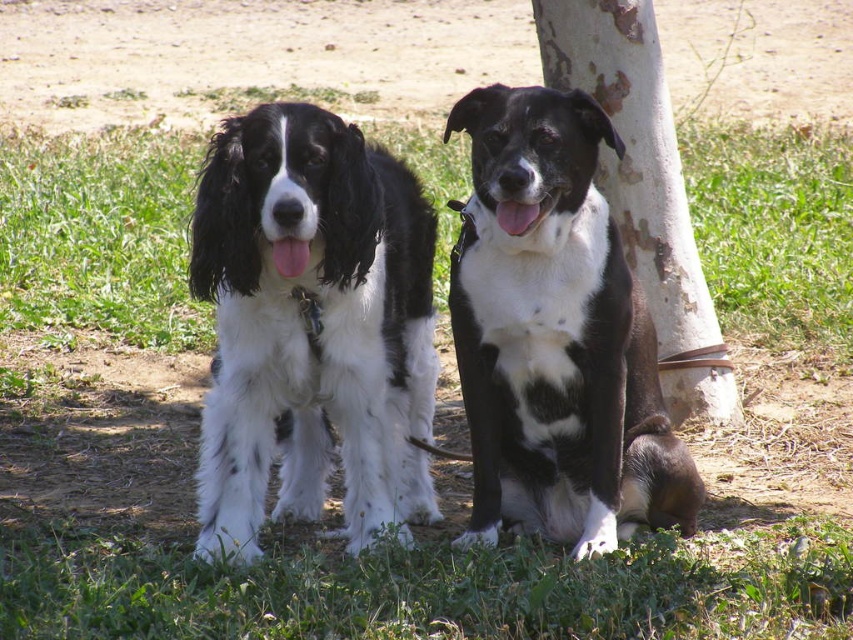
In the scene shown: Is soft white fur at center taller than white rough bark at center?

No.

Who is more forward, (358, 380) or (636, 99)?

Positioned in front is point (358, 380).

Where is `soft white fur at center`? soft white fur at center is located at coordinates (312, 326).

Between black/white fur dog at center and green grass at lower center, which one is positioned higher?

black/white fur dog at center is above.

Based on the photo, is black/white fur dog at center closer to the viewer compared to green grass at lower center?

No.

This screenshot has height=640, width=853. Find the location of `black/white fur dog at center`. black/white fur dog at center is located at coordinates (555, 336).

Is soft white fur at center below black/white fur dog at center?

Correct, soft white fur at center is located below black/white fur dog at center.

Is soft white fur at center further to the viewer compared to black/white fur dog at center?

Yes, it is behind black/white fur dog at center.

Between point (421, 474) and point (503, 172), which one is positioned behind?

Point (421, 474)

Locate an element on the screen. soft white fur at center is located at coordinates (312, 326).